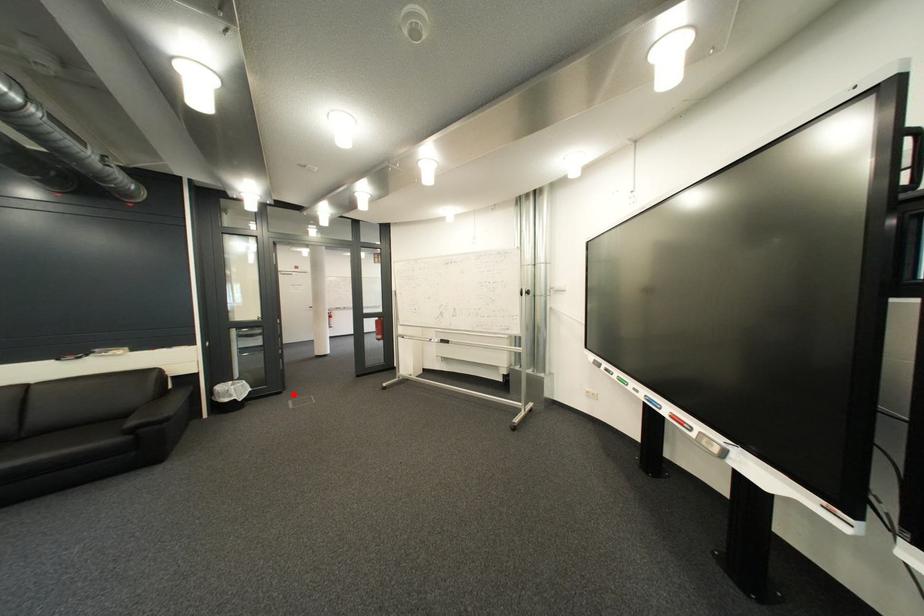
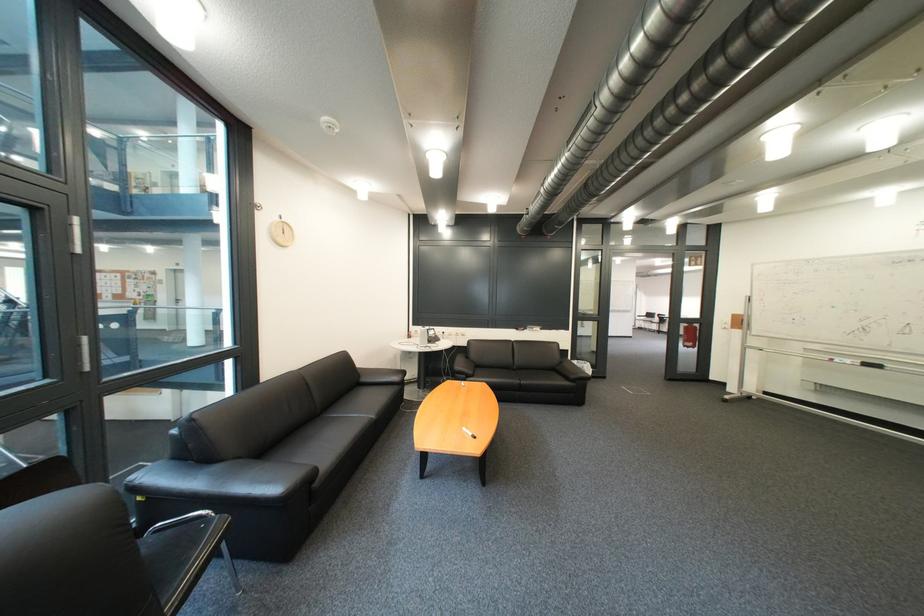
Question: A red point is marked in image1. In image2, is the corresponding 3D point closer to the camera or farther? Reply with the corresponding letter.

Choices:
 (A) The corresponding 3D point is closer.
 (B) The corresponding 3D point is farther.

Answer: (B)